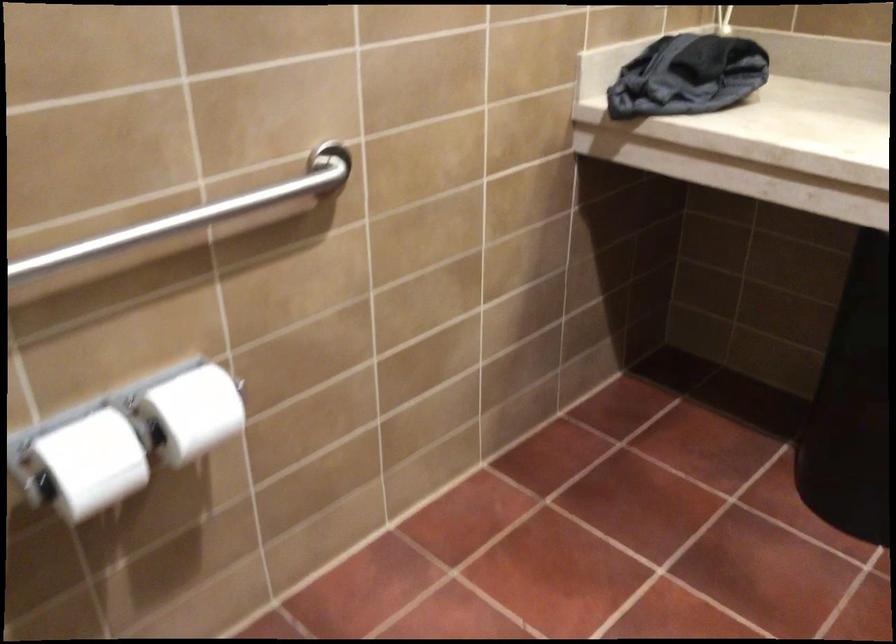
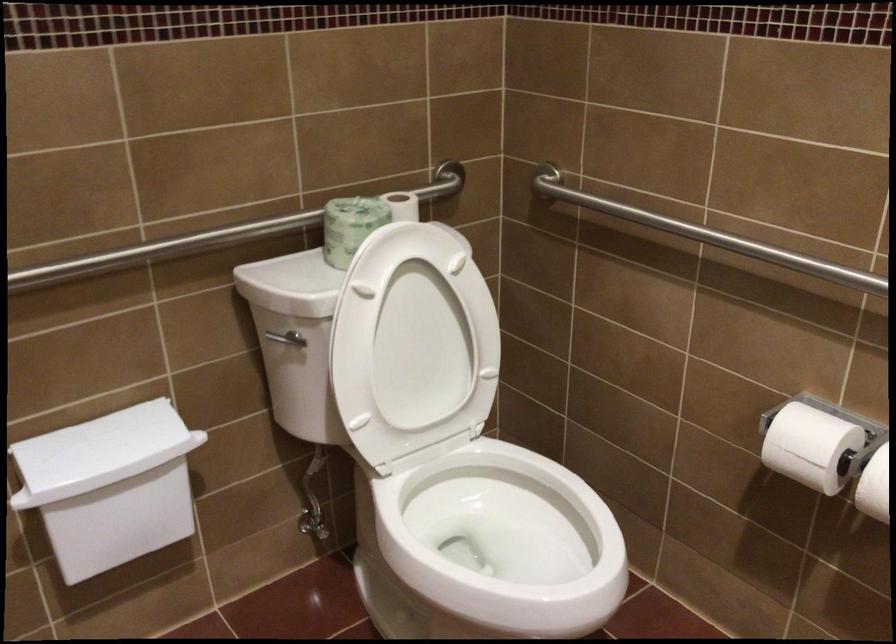
Find the pixel in the second image that matches the point at 192,433 in the first image.

(874, 486)